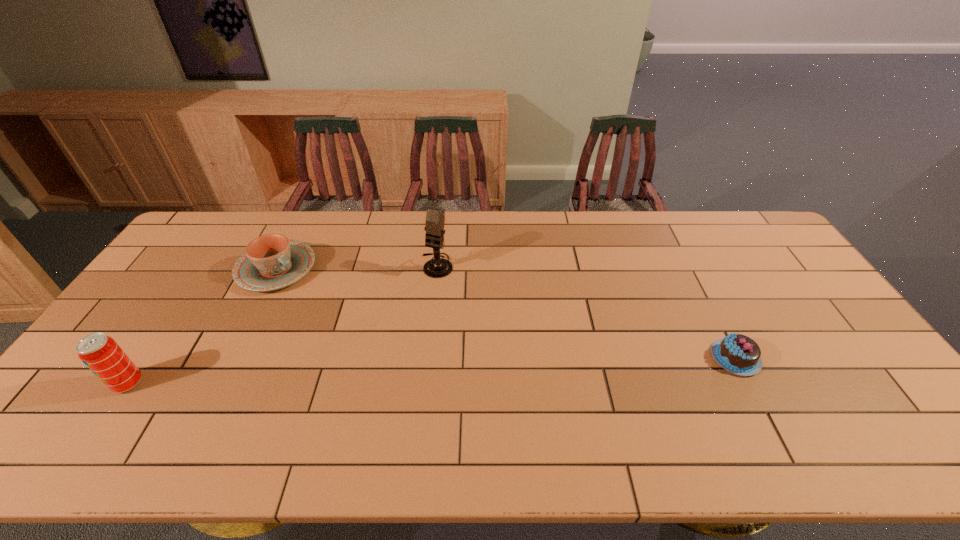
At what (x,y) coordinates should I click in order to perform the action: click on free spot on the desktop that is between the leftmost object and the chocolate cake and is positioned on the front-facing side of the tallest object. Please return your answer as a coordinate pair (x, y). Looking at the image, I should click on (374, 373).

At what (x,y) coordinates should I click in order to perform the action: click on vacant spot on the desktop that is between the second tallest object and the chocolate cake and is positioned on the handle side of the second shortest object. Please return your answer as a coordinate pair (x, y). The width and height of the screenshot is (960, 540). Looking at the image, I should click on (425, 370).